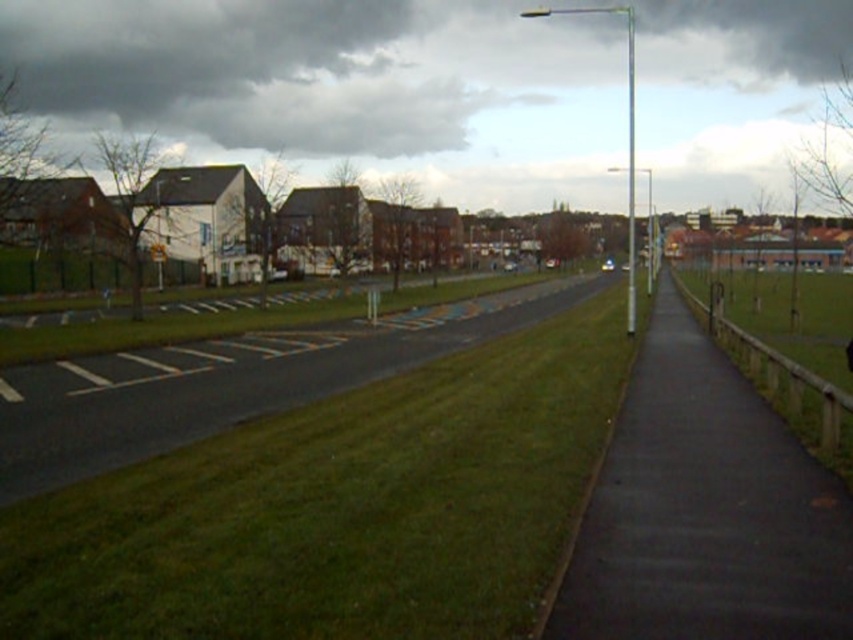
Question: Which object appears farthest from the camera in this image?

Choices:
 (A) black asphalt sidewalk at right
 (B) green grass at center

Answer: (A)

Question: In this image, where is green grass at center located relative to black asphalt sidewalk at right?

Choices:
 (A) above
 (B) below

Answer: (B)

Question: Which point appears farthest from the camera in this image?

Choices:
 (A) (643, 364)
 (B) (496, 625)

Answer: (A)

Question: Is green grass at center further to the viewer compared to black asphalt sidewalk at right?

Choices:
 (A) no
 (B) yes

Answer: (A)

Question: Where is green grass at center located in relation to black asphalt sidewalk at right in the image?

Choices:
 (A) right
 (B) left

Answer: (B)